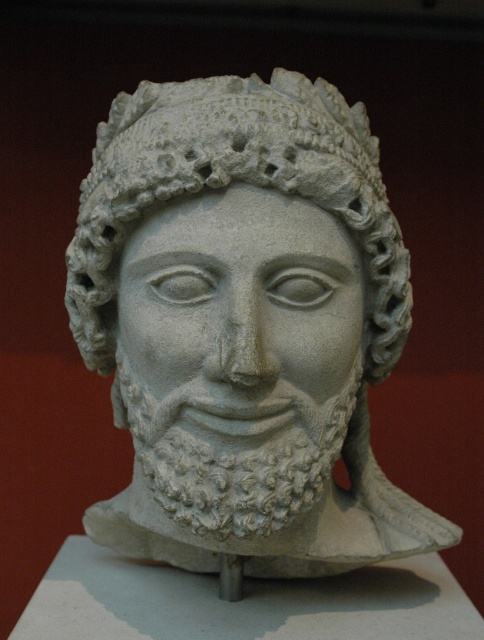
You are an art conservator examining the classical stone bust displayed against a dark red background. You notice a specific point at coordinates [244,324]. What does this point correspond to?

The point at coordinates [244,324] corresponds to the white stone bust at center.

You are an art conservator examining the white stone bust at center and the white stone face at center in the image. Which object is taller?

The white stone bust at center is much taller than the white stone face at center.